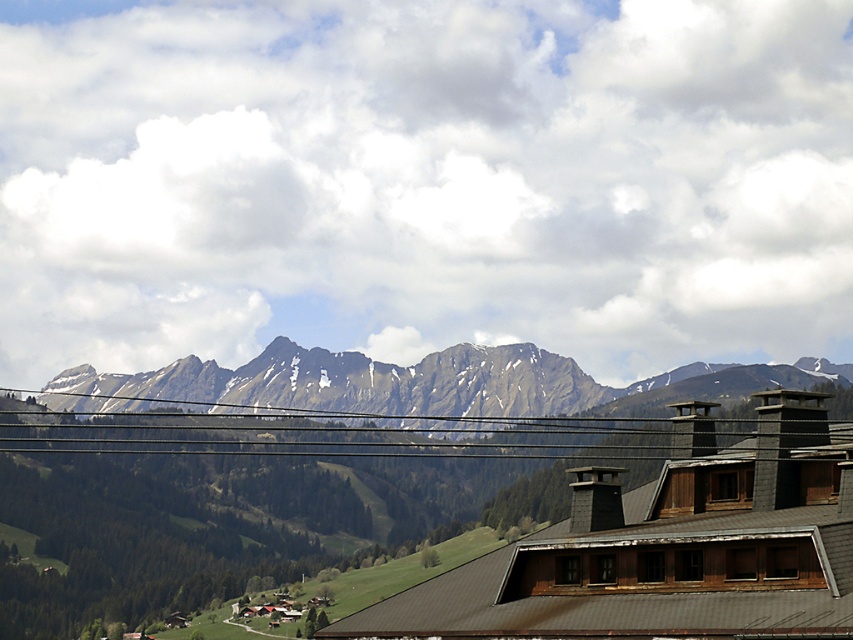
Between green textured mountain range at center and black wire at center, which one appears on the left side from the viewer's perspective?

black wire at center

Between point (132, 384) and point (363, 435), which one is positioned behind?

Point (132, 384)

At what (x,y) coordinates should I click in order to perform the action: click on green textured mountain range at center. Please return your answer as a coordinate pair (x, y). Looking at the image, I should click on (405, 384).

Where is `green textured mountain range at center`? The height and width of the screenshot is (640, 853). green textured mountain range at center is located at coordinates pos(405,384).